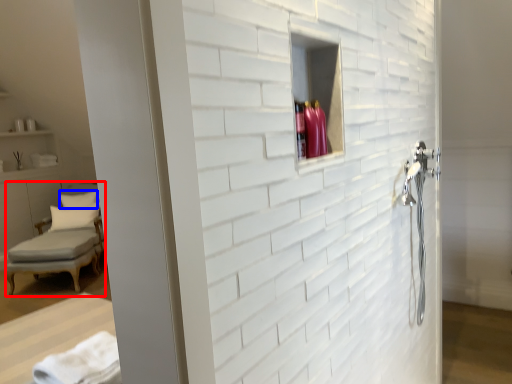
Question: Which point is further to the camera, chair (highlighted by a red box) or pillow (highlighted by a blue box)?

Choices:
 (A) chair
 (B) pillow

Answer: (B)